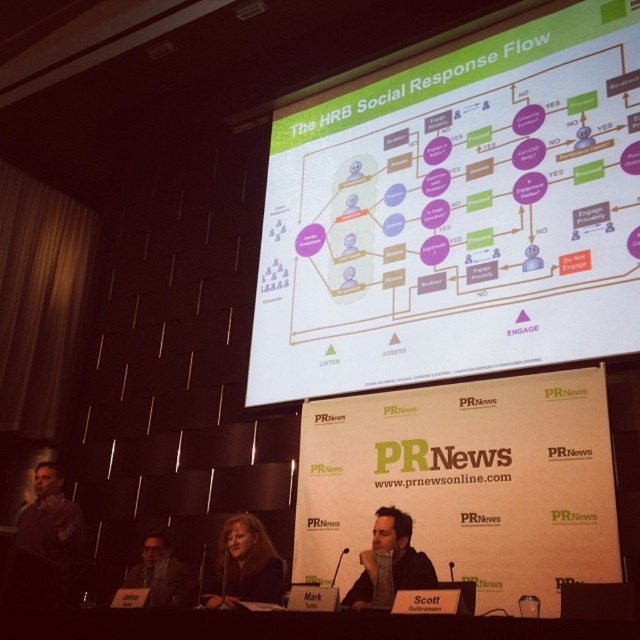
You are an attendee at the conference and you want to take notes on the presentation. You have a pen in your hand. Which object, the white paper at upper center or the dark brown leather jacket at lower left, would be a better surface to write on?

The white paper at upper center is much taller than the dark brown leather jacket at lower left, so it would be a better surface to write on since it provides more space.

Consider the image. You are attending a PR conference and notice two people at the center of the stage. One has dark brown hair at center and the other is wearing a matte black suit at center. From your perspective, which one is more to the left?

The dark brown hair at center is positioned on the left side of matte black suit at center, so the dark brown hair at center is more to the left.

You are organizing a presentation and need to place a name tag on the white paper at upper center and dark brown leather jacket at lower left. Which object has a larger surface area to accommodate the name tag?

The white paper at upper center has a larger surface area than the dark brown leather jacket at lower left because its width surpasses the jacket, making it more suitable for placing the name tag.